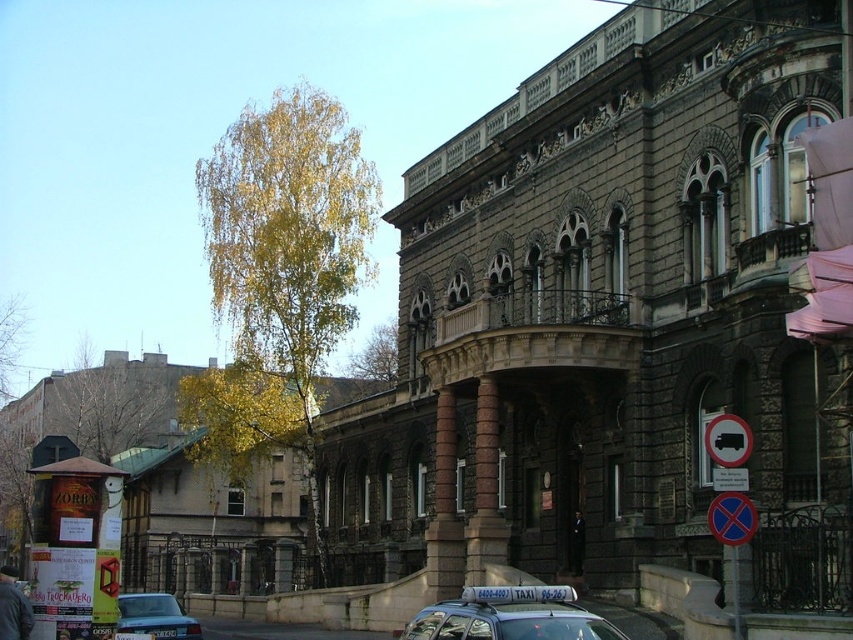
Which is behind, point (386, 385) or point (733, 538)?

The point (386, 385) is behind.

From the picture: Does yellow leafy tree at upper left have a smaller size compared to blue plastic sign at lower right?

No, yellow leafy tree at upper left is not smaller than blue plastic sign at lower right.

Between point (373, 339) and point (718, 532), which one is positioned in front?

Point (718, 532) is more forward.

Where is `yellow leafy tree at upper left`? This screenshot has height=640, width=853. yellow leafy tree at upper left is located at coordinates (376, 355).

This screenshot has width=853, height=640. Identify the location of yellow-green leaves at left. (111, 403).

Does yellow-green leaves at left appear on the right side of blue metallic taxi at center?

No, yellow-green leaves at left is not to the right of blue metallic taxi at center.

Measure the distance between yellow-green leaves at left and camera.

yellow-green leaves at left is 160.06 meters from camera.

The width and height of the screenshot is (853, 640). I want to click on yellow-green leaves at left, so click(x=111, y=403).

Is blue metallic taxi at center to the left of white plastic bus at upper right from the viewer's perspective?

Yes, blue metallic taxi at center is to the left of white plastic bus at upper right.

Who is positioned more to the left, blue metallic taxi at center or white plastic bus at upper right?

Result: Positioned to the left is blue metallic taxi at center.

Between point (125, 598) and point (724, 461), which one is positioned in front?

Point (724, 461) is in front.

Find the location of a particular element. The width and height of the screenshot is (853, 640). blue metallic taxi at center is located at coordinates (155, 616).